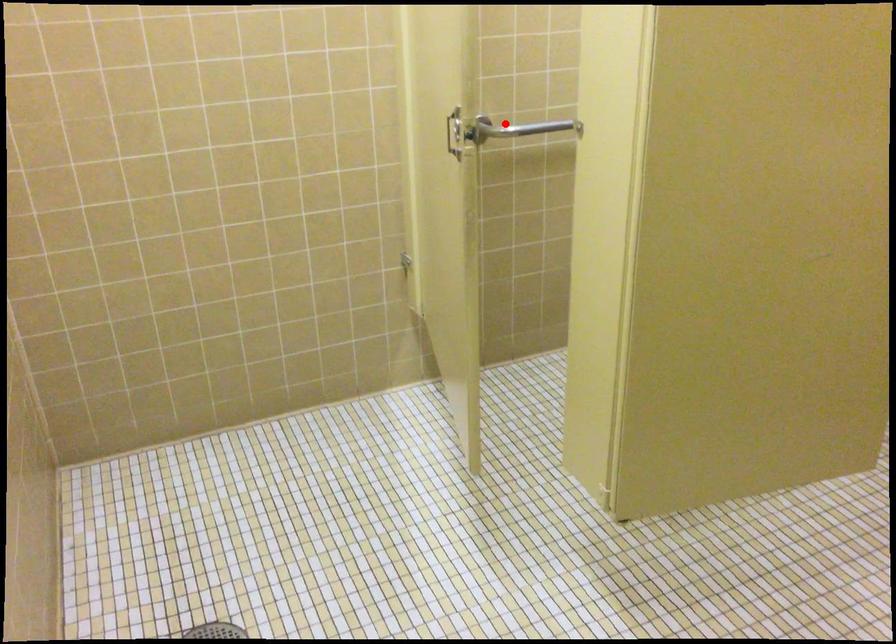
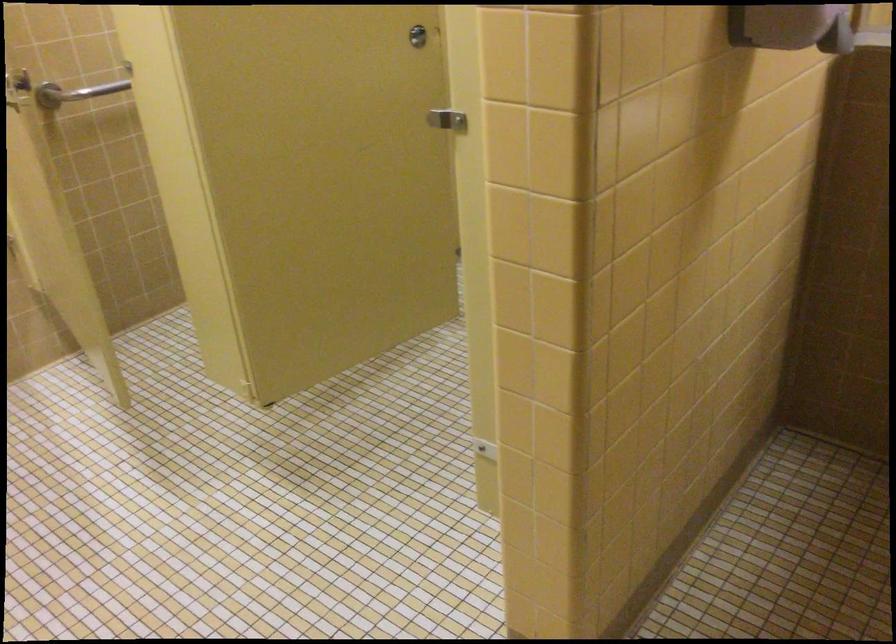
In the second image, find the point that corresponds to the highlighted location in the first image.

(75, 91)